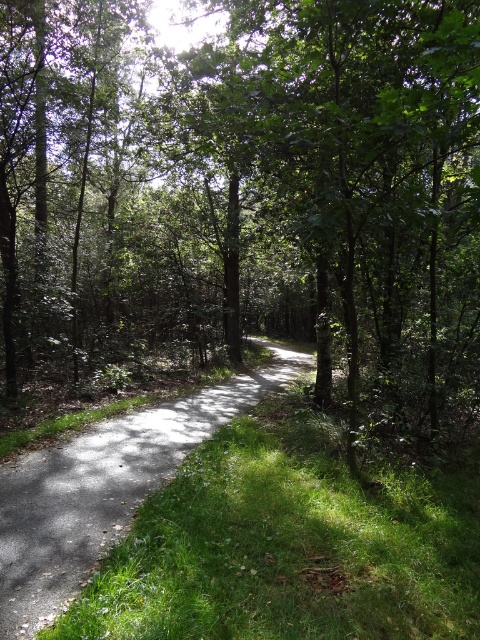
Question: Which point is closer to the camera?

Choices:
 (A) green leafy tree at center
 (B) gray asphalt trail at center

Answer: (B)

Question: Observing the image, what is the correct spatial positioning of green leafy tree at center in reference to gray asphalt trail at center?

Choices:
 (A) right
 (B) left

Answer: (B)

Question: Which point is closer to the camera?

Choices:
 (A) (122, 476)
 (B) (27, 115)

Answer: (A)

Question: Can you confirm if green leafy tree at center is positioned above gray asphalt trail at center?

Choices:
 (A) yes
 (B) no

Answer: (A)

Question: Does green leafy tree at center have a smaller size compared to gray asphalt trail at center?

Choices:
 (A) yes
 (B) no

Answer: (B)

Question: Among these points, which one is nearest to the camera?

Choices:
 (A) (101, 536)
 (B) (51, 380)

Answer: (A)